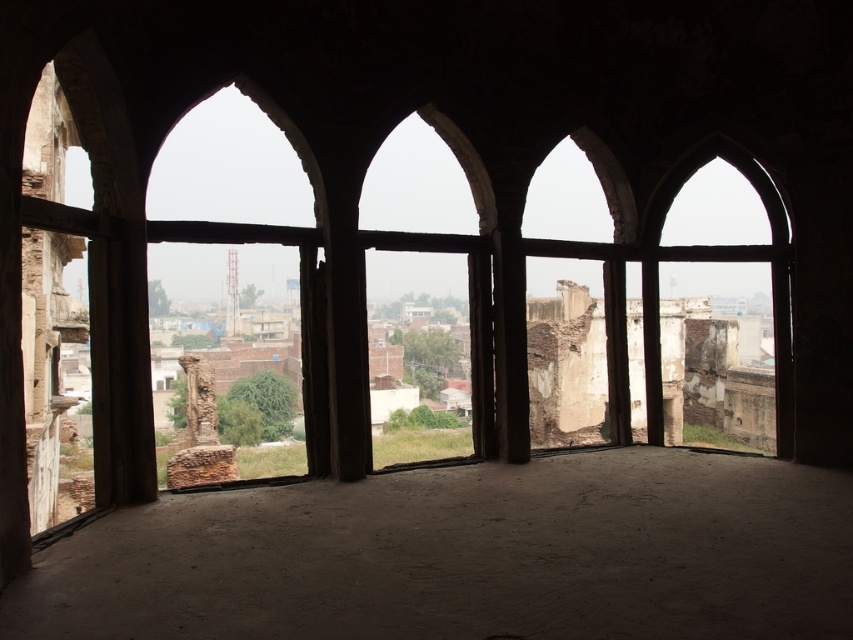
You are an architect evaluating the structural integrity of the building. You notice two windows, the matte stone window at center and the matte stone window at left. Based on their positions, which window is positioned lower in the building?

The matte stone window at center is located below the matte stone window at left, so the matte stone window at center is positioned lower in the building.

You are an architect assessing the structural integrity of the building. You notice two windows, the matte stone window at left and the matte stone window at right. Which window has a greater width, and how might this affect the building design?

The matte stone window at left has a greater width than the matte stone window at right. This difference in width could influence structural considerations, such as load distribution or aesthetic balance in the building design.